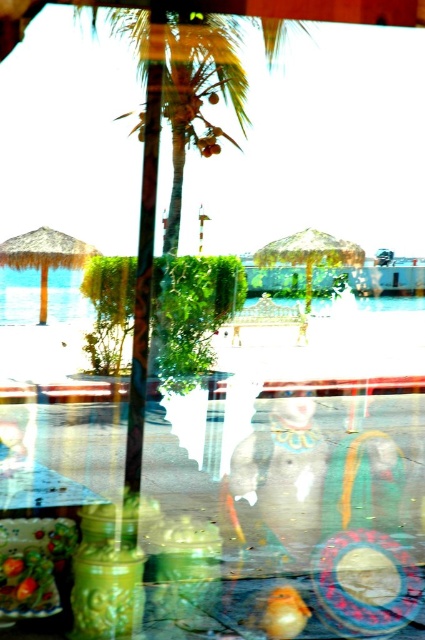
Question: Among these objects, which one is farthest from the camera?

Choices:
 (A) shiny brown coconut at center
 (B) green glossy jar at center
 (C) green matte glass jar at center

Answer: (A)

Question: Estimate the real-world distances between objects in this image. Which object is farther from the shiny brown coconut at center?

Choices:
 (A) ripe orange fruit at center
 (B) green matte glass jar at center
 (C) green glossy jar at center

Answer: (C)

Question: Is green glossy jar at center positioned before shiny brown coconut at center?

Choices:
 (A) yes
 (B) no

Answer: (A)

Question: Among these objects, which one is farthest from the camera?

Choices:
 (A) green glossy jar at center
 (B) green matte glass jar at center
 (C) ripe orange fruit at center

Answer: (C)

Question: Is green glossy jar at center bigger than shiny brown coconut at center?

Choices:
 (A) no
 (B) yes

Answer: (B)

Question: Can you confirm if green matte glass jar at center is smaller than ripe orange fruit at center?

Choices:
 (A) yes
 (B) no

Answer: (B)